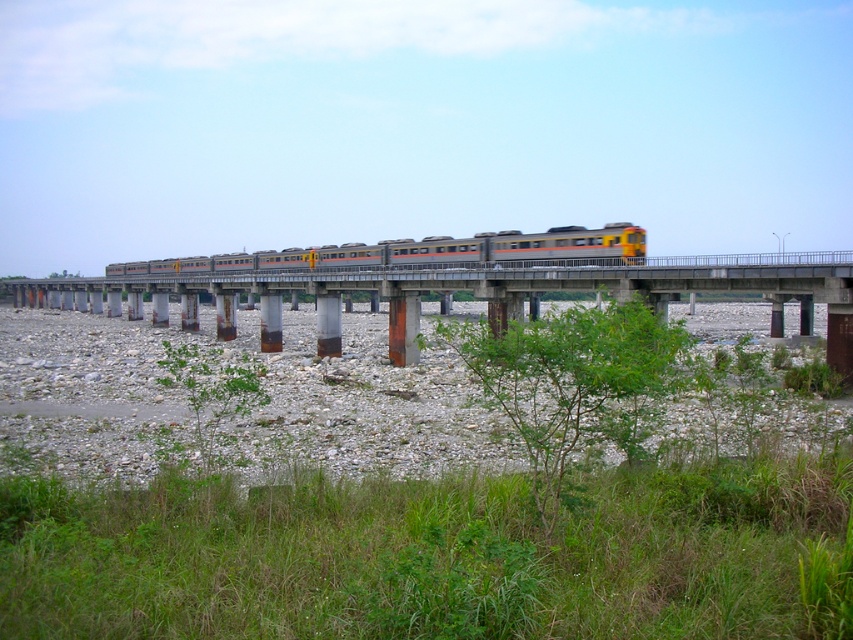
You are standing at the edge of the dry riverbed and see the green leafy shrub at lower center and the metallic silver train at center. Which object is closer to you?

The green leafy shrub at lower center is closer to you since it is positioned in front of the metallic silver train at center.

You are standing on the train bridge and looking down at the dry riverbed. You notice two points marked on the ground below. Which point is closer to your eyes when you look down from the bridge? The points are labeled as point (767,300) and point (538,506).

Point (767,300) is further to the viewer than point (538,506), so the point closer to your eyes when looking down would be point (538,506).

You are a passenger on the metallic silver train at center. Looking out the window, you notice a green leafy shrub at lower center. Which object appears taller from your viewpoint?

The metallic silver train at center appears taller than the green leafy shrub at lower center because the shrub is shorter than the train.